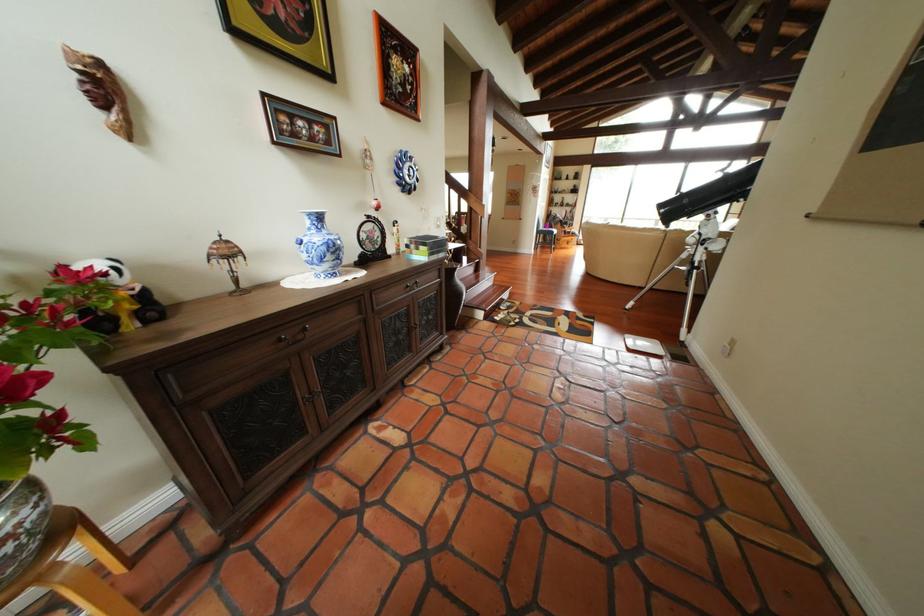
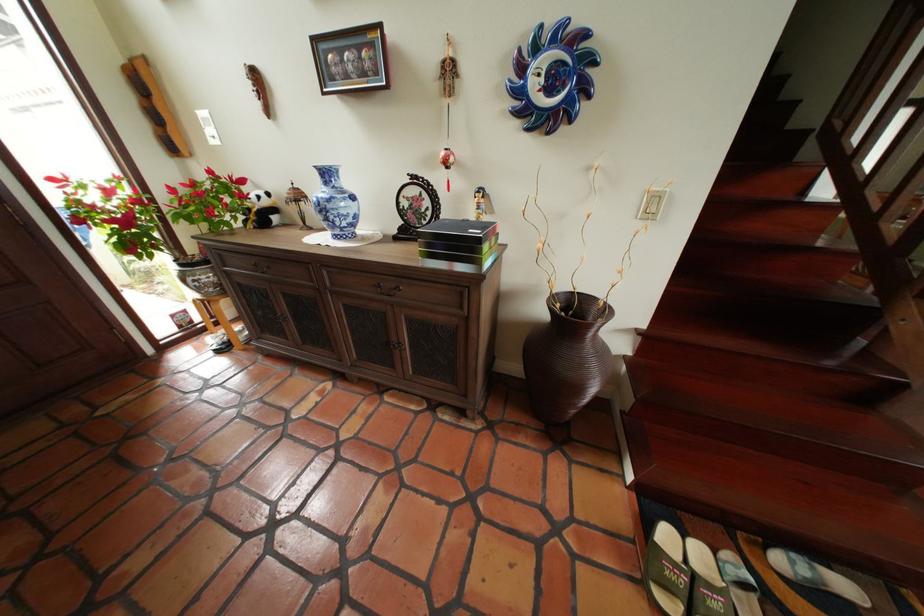
The point at (422, 177) is marked in the first image. Where is the corresponding point in the second image?

(563, 91)